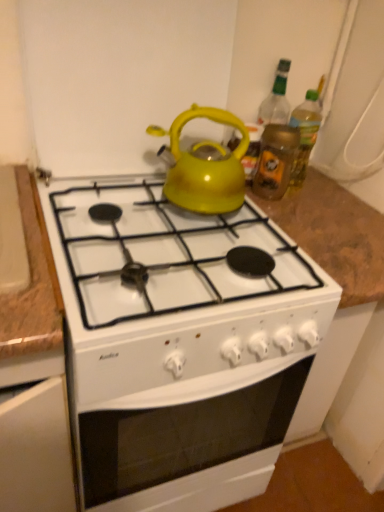
This screenshot has height=512, width=384. I want to click on white glossy stove at center, so click(179, 347).

What do you see at coordinates (179, 347) in the screenshot? The width and height of the screenshot is (384, 512). I see `white glossy stove at center` at bounding box center [179, 347].

You are a GUI agent. You are given a task and a screenshot of the screen. Output one action in this format:
    pyautogui.click(x=<x>, y=<y>)
    Task: Click on the white glossy stove at center
    The image size is (384, 512).
    Given the screenshot: What is the action you would take?
    pyautogui.click(x=179, y=347)